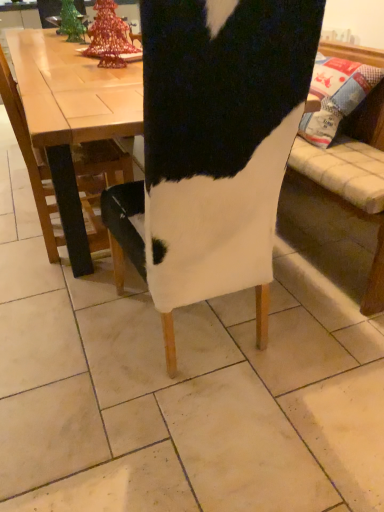
Question: In terms of size, does white fabric chair at center, the 1th chair positioned from the right, appear bigger or smaller than white fabric chair at left, the second chair in the right-to-left sequence?

Choices:
 (A) big
 (B) small

Answer: (A)

Question: Considering the positions of point (249, 39) and point (87, 159), is point (249, 39) closer or farther from the camera than point (87, 159)?

Choices:
 (A) farther
 (B) closer

Answer: (B)

Question: Do you think white fabric chair at center, the second chair viewed from the left, is within white fabric chair at left, the second chair in the right-to-left sequence, or outside of it?

Choices:
 (A) inside
 (B) outside

Answer: (B)

Question: Relative to white fabric chair at center, the second chair viewed from the left, is white fabric chair at left, the 1th chair in the left-to-right sequence, in front or behind?

Choices:
 (A) front
 (B) behind

Answer: (B)

Question: From the image's perspective, relative to white fabric chair at center, the 1th chair positioned from the right, is white fabric chair at left, the second chair in the right-to-left sequence, above or below?

Choices:
 (A) above
 (B) below

Answer: (A)

Question: In terms of height, does white fabric chair at left, the second chair in the right-to-left sequence, look taller or shorter compared to white fabric chair at center, the 1th chair positioned from the right?

Choices:
 (A) short
 (B) tall

Answer: (A)

Question: Choose the correct answer: Is white fabric chair at left, the second chair in the right-to-left sequence, inside white fabric chair at center, the second chair viewed from the left, or outside it?

Choices:
 (A) outside
 (B) inside

Answer: (A)